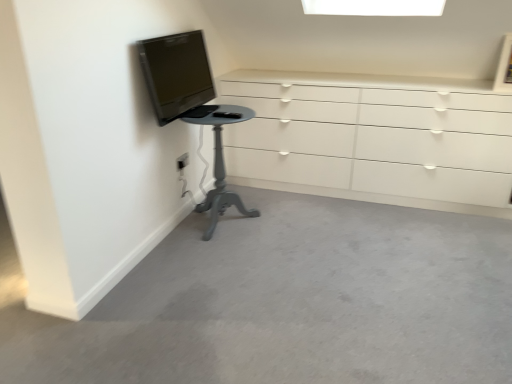
Question: Are matte black tv at upper left and white glossy chest of drawers at upper right far apart?

Choices:
 (A) no
 (B) yes

Answer: (A)

Question: From the image's perspective, is matte black tv at upper left beneath white glossy chest of drawers at upper right?

Choices:
 (A) no
 (B) yes

Answer: (A)

Question: From a real-world perspective, is matte black tv at upper left beneath white glossy chest of drawers at upper right?

Choices:
 (A) no
 (B) yes

Answer: (A)

Question: Does matte black tv at upper left turn towards white glossy chest of drawers at upper right?

Choices:
 (A) yes
 (B) no

Answer: (B)

Question: From a real-world perspective, is matte black tv at upper left over white glossy chest of drawers at upper right?

Choices:
 (A) no
 (B) yes

Answer: (B)

Question: Is matte black tv at upper left located outside white glossy chest of drawers at upper right?

Choices:
 (A) yes
 (B) no

Answer: (A)

Question: Is matte gray pedestal table at lower left a part of white glossy chest of drawers at upper right?

Choices:
 (A) no
 (B) yes

Answer: (A)

Question: Are white glossy chest of drawers at upper right and matte gray pedestal table at lower left far apart?

Choices:
 (A) yes
 (B) no

Answer: (B)

Question: Considering the relative sizes of white glossy chest of drawers at upper right and matte gray pedestal table at lower left in the image provided, is white glossy chest of drawers at upper right thinner than matte gray pedestal table at lower left?

Choices:
 (A) yes
 (B) no

Answer: (B)

Question: From the image's perspective, is white glossy chest of drawers at upper right located beneath matte gray pedestal table at lower left?

Choices:
 (A) no
 (B) yes

Answer: (A)

Question: Does white glossy chest of drawers at upper right appear on the left side of matte gray pedestal table at lower left?

Choices:
 (A) no
 (B) yes

Answer: (A)

Question: Is the depth of white glossy chest of drawers at upper right less than that of matte gray pedestal table at lower left?

Choices:
 (A) no
 (B) yes

Answer: (A)

Question: Is white plastic electric outlet at lower left with matte gray pedestal table at lower left?

Choices:
 (A) yes
 (B) no

Answer: (B)